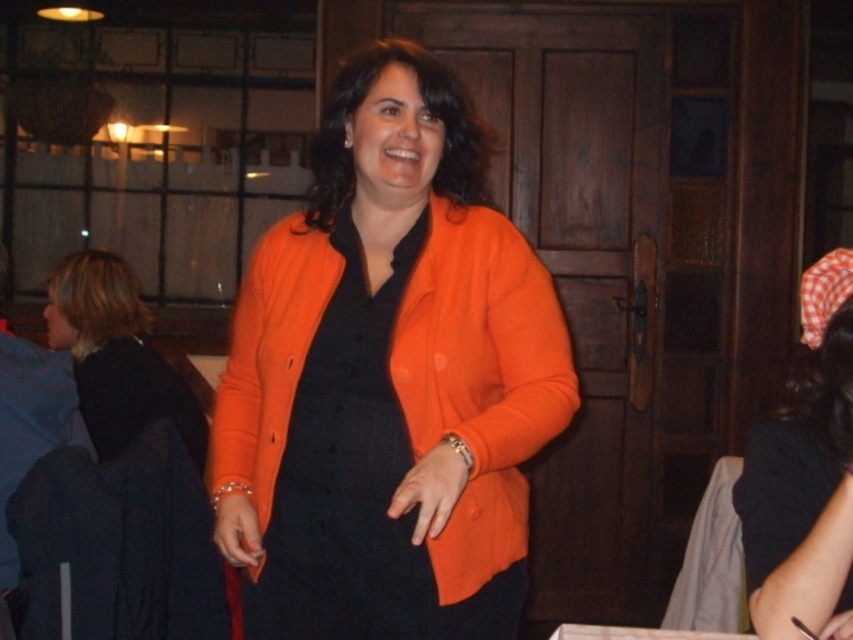
Question: Which object appears closest to the camera in this image?

Choices:
 (A) orange matte blazer at center
 (B) orange matte cardigan at center
 (C) black matte dress at left
 (D) matte black dress at center

Answer: (A)

Question: Can you confirm if orange matte cardigan at center is positioned above matte black dress at center?

Choices:
 (A) no
 (B) yes

Answer: (B)

Question: Does orange matte blazer at center appear on the right side of black matte dress at left?

Choices:
 (A) no
 (B) yes

Answer: (B)

Question: Does orange matte cardigan at center appear under orange matte blazer at center?

Choices:
 (A) no
 (B) yes

Answer: (A)

Question: Which of these objects is positioned farthest from the matte black dress at center?

Choices:
 (A) black matte dress at left
 (B) orange matte cardigan at center

Answer: (A)

Question: Which object is the closest to the orange matte cardigan at center?

Choices:
 (A) orange matte blazer at center
 (B) black matte dress at left

Answer: (A)